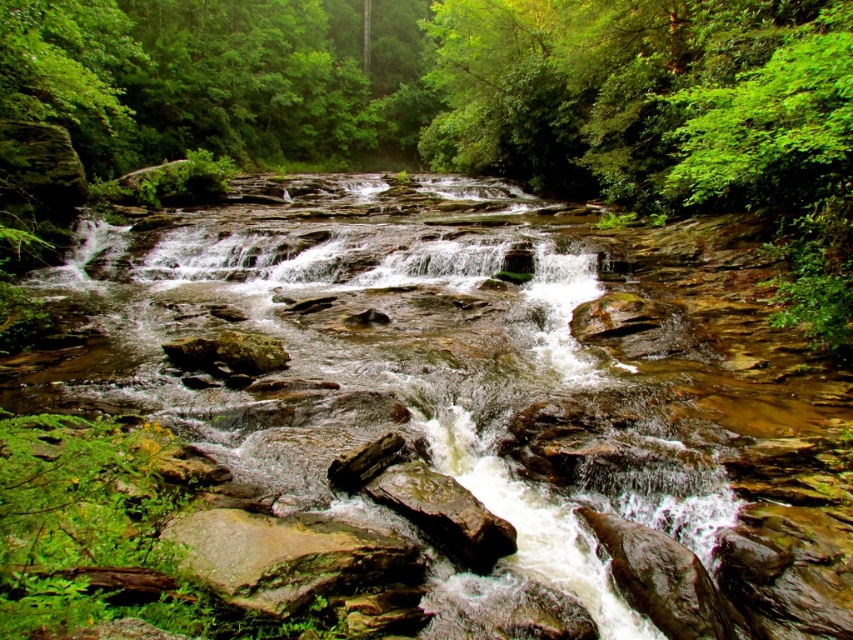
Question: Which point is closer to the camera?

Choices:
 (A) rusty metallic rock at center
 (B) brown rock mountain stream at center

Answer: (B)

Question: Which of the following is the farthest from the observer?

Choices:
 (A) pyautogui.click(x=447, y=362)
 (B) pyautogui.click(x=219, y=346)

Answer: (A)

Question: Among these objects, which one is farthest from the camera?

Choices:
 (A) brown rock mountain stream at center
 (B) rusty metallic rock at center

Answer: (B)

Question: Does brown rock mountain stream at center have a greater width compared to rusty metallic rock at center?

Choices:
 (A) yes
 (B) no

Answer: (A)

Question: Is brown rock mountain stream at center further to camera compared to rusty metallic rock at center?

Choices:
 (A) no
 (B) yes

Answer: (A)

Question: Can you confirm if brown rock mountain stream at center is positioned to the left of rusty metallic rock at center?

Choices:
 (A) yes
 (B) no

Answer: (B)